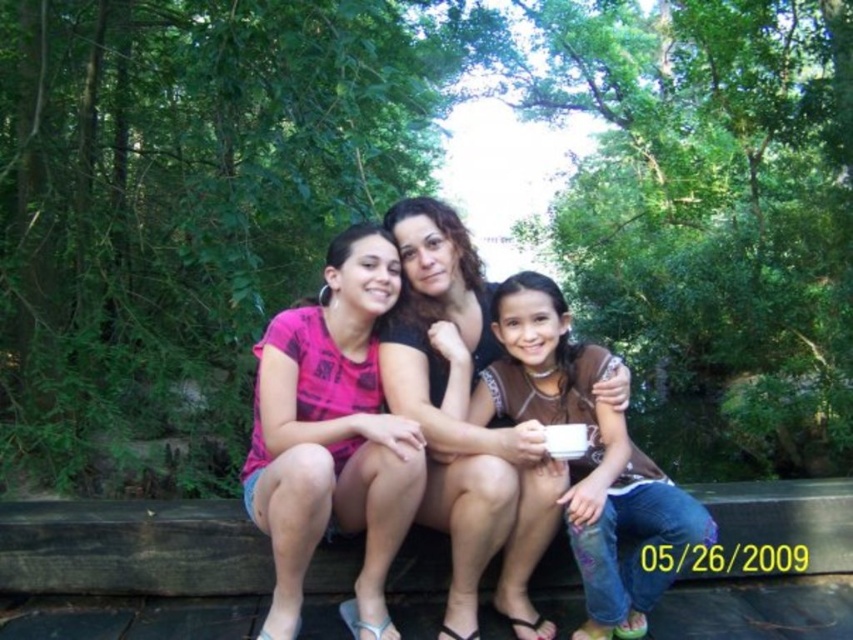
You are trying to locate the matte black shirt at center in the image. According to the coordinates provided, where would you find it?

The matte black shirt at center is located at point 0.664 on the x axis and 0.546 on the y axis.

You are standing in the park and see three people sitting on a wooden bench. You need to place a small gift exactly at the point with coordinates [332,435]. Which person should you target to ensure the gift lands on their clothing?

The point with coordinates [332,435] is on the pink fabric shirt at center, so you should target the person wearing the pink fabric shirt at center to ensure the gift lands on their clothing.